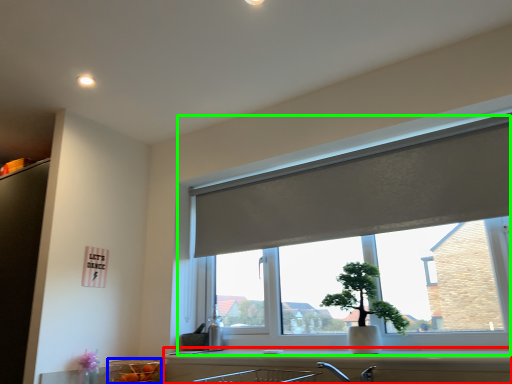
Question: Estimate the real-world distances between objects in this image. Which object is closer to counter top (highlighted by a red box), glass bowl (highlighted by a blue box) or window (highlighted by a green box)?

Choices:
 (A) glass bowl
 (B) window

Answer: (A)